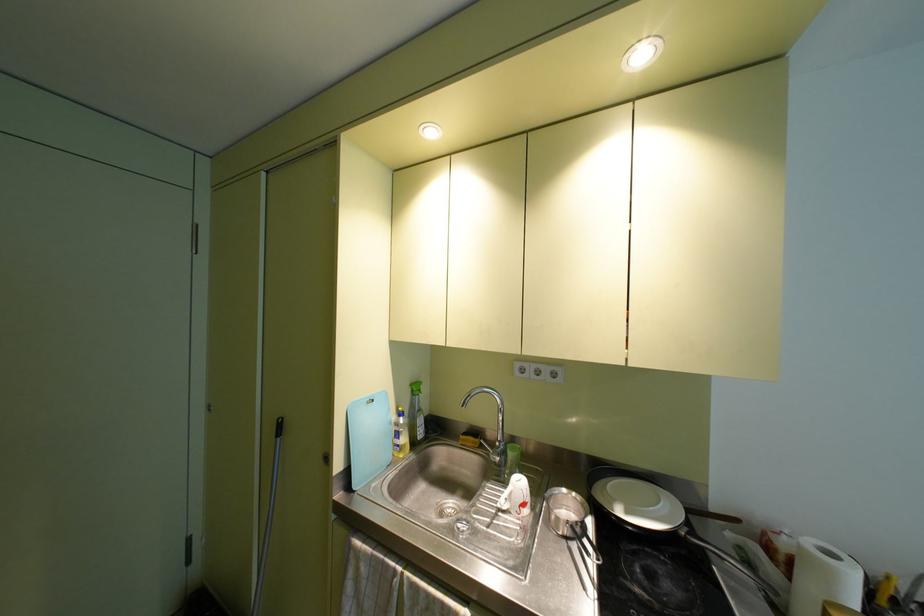
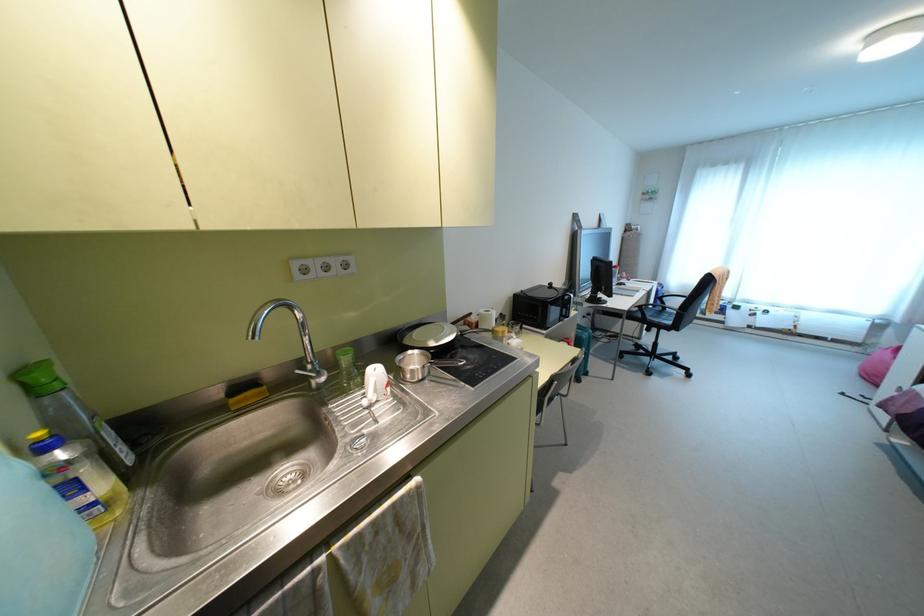
In the second image, find the point that corresponds to pixel 626 512 in the first image.

(435, 341)